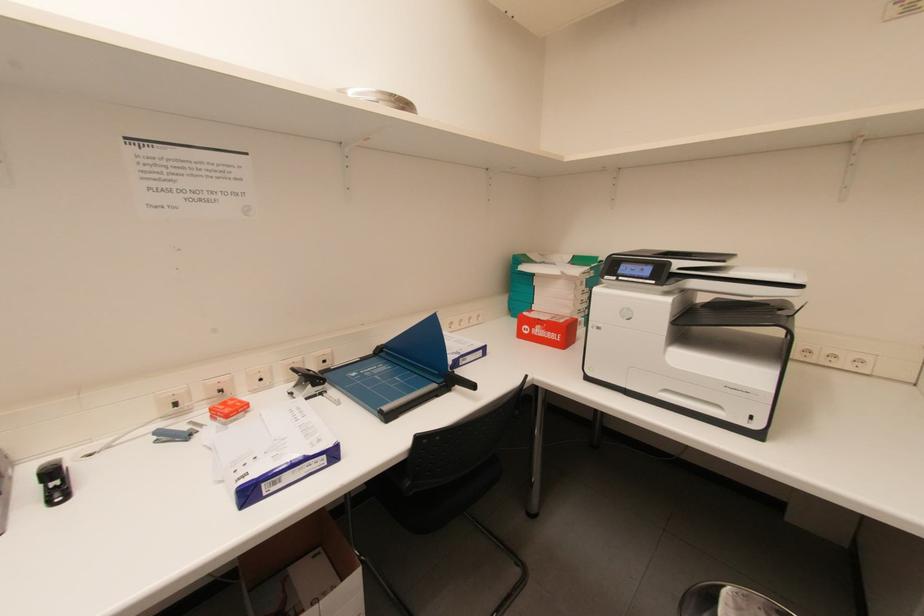
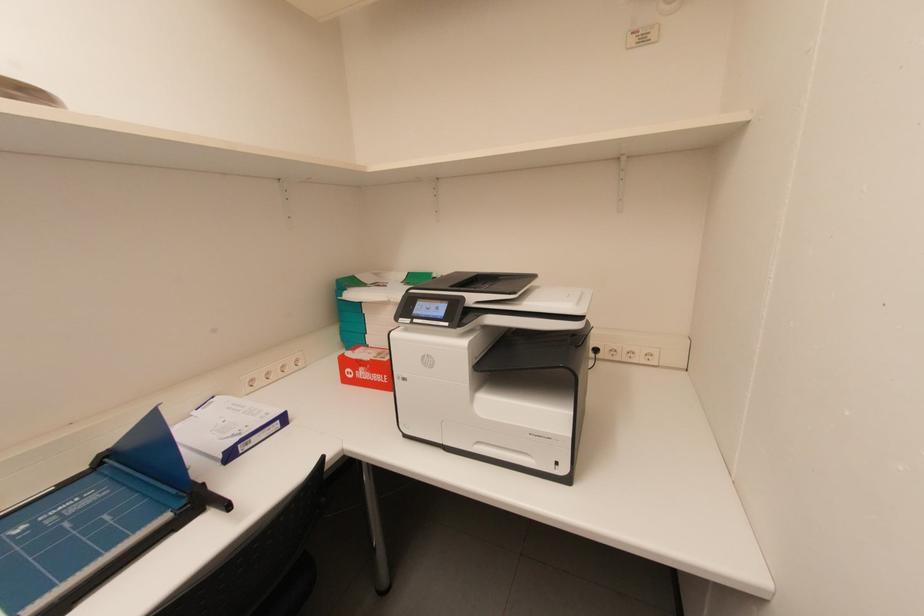
Question: The camera is either moving clockwise (left) or counter-clockwise (right) around the object. The first image is from the beginning of the video and the second image is from the end. Is the camera moving left or right when shooting the video?

Choices:
 (A) Left
 (B) Right

Answer: (A)